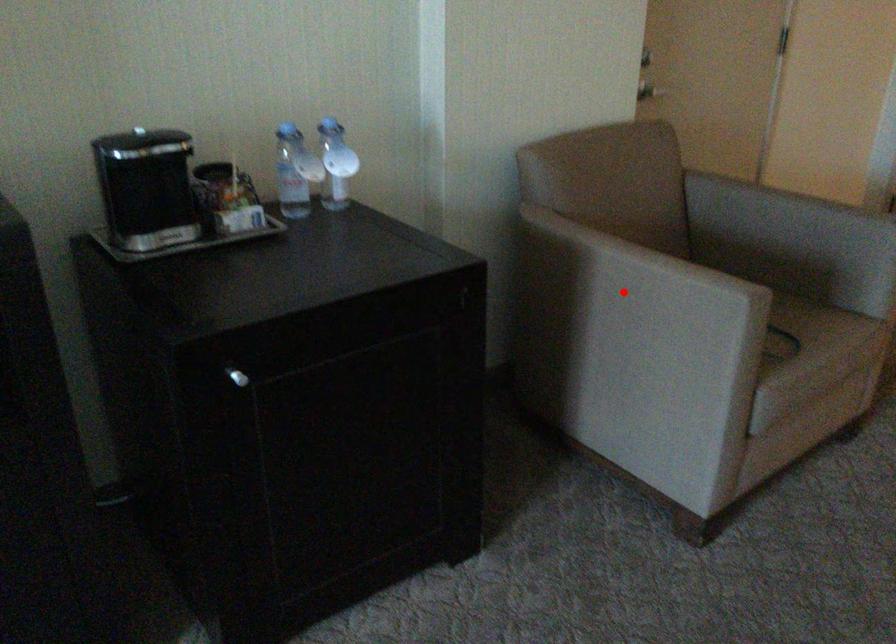
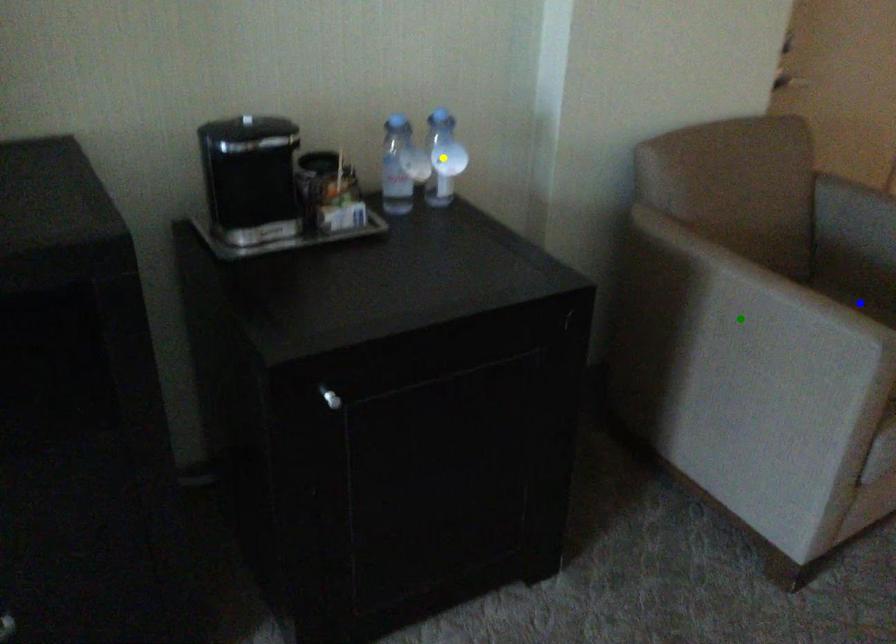
Question: I am providing you with two images of the same scene from different viewpoints. A red point is marked on the first image. You are given multiple points on the second image. Which point in image 2 is actually the same real-world point as the red point in image 1?

Choices:
 (A) blue point
 (B) green point
 (C) yellow point

Answer: (B)